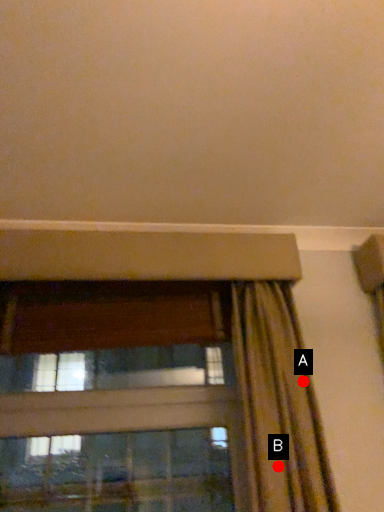
Question: Two points are circled on the image, labeled by A and B beside each circle. Which point is farther to the camera?

Choices:
 (A) A is further
 (B) B is further

Answer: (A)